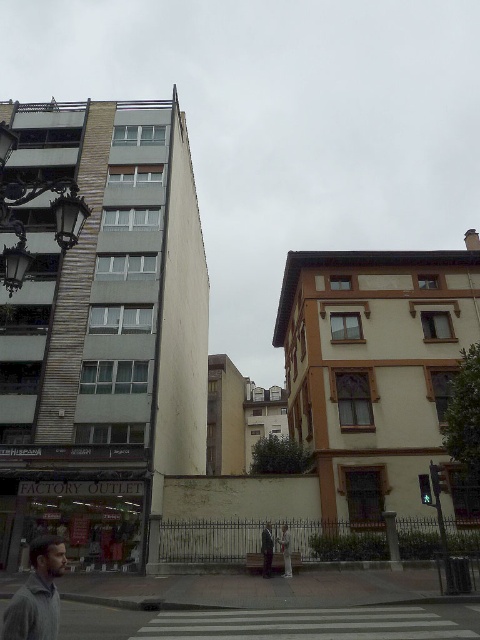
You are standing on the street and see two points marked in the image. The first point is at coordinate point [21,612] and the second is at point [265,540]. Which point is closer to you?

Point [21,612] is closer to the viewer than point [265,540].

Consider the image. You are a customer looking for a new outfit. You see a gray woolen sweater at lower left and a dark gray suit at center in the store. Which item is located more to the left side of the store?

The gray woolen sweater at lower left is positioned on the left side of the dark gray suit at center, so the gray woolen sweater at lower left is more to the left side of the store.

You are a customer at the store and you see the gray woolen sweater at lower left and the dark gray suit at center. Which clothing item is placed on top of the other?

The gray woolen sweater at lower left is positioned over the dark gray suit at center.